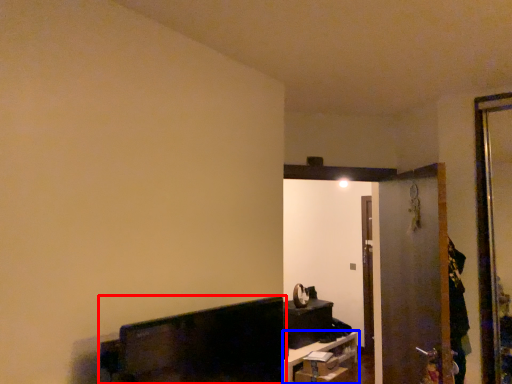
Question: Which point is further to the camera, furniture (highlighted by a red box) or furniture (highlighted by a blue box)?

Choices:
 (A) furniture
 (B) furniture

Answer: (B)